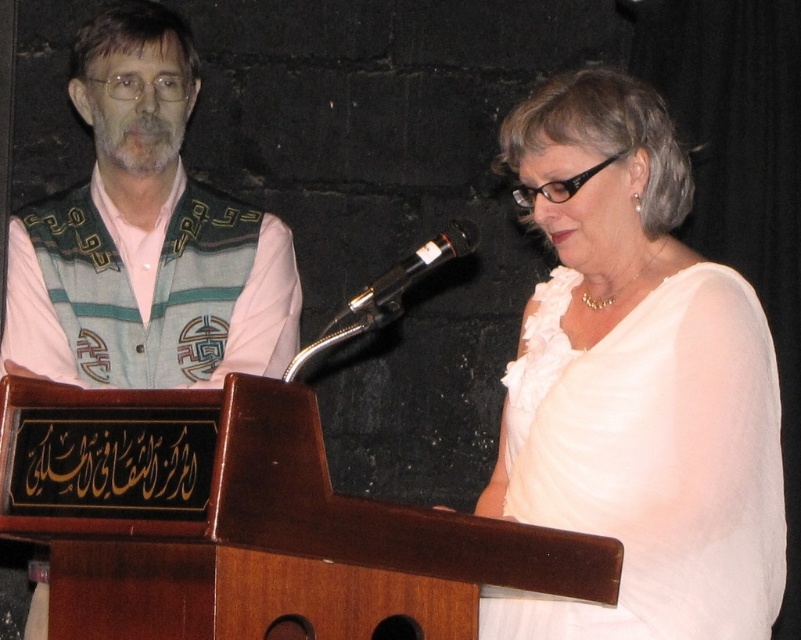
You are a tailor who needs to locate the patterned fabric vest at left in the image. Where exactly is it positioned?

The patterned fabric vest at left is located at point [143,236].

You are designing a poster for an event and need to know which object in the image is bigger. You see the patterned fabric vest at left and the black metallic microphone at center. Which one is larger?

The patterned fabric vest at left is larger in size than the black metallic microphone at center, so the vest is the larger object.